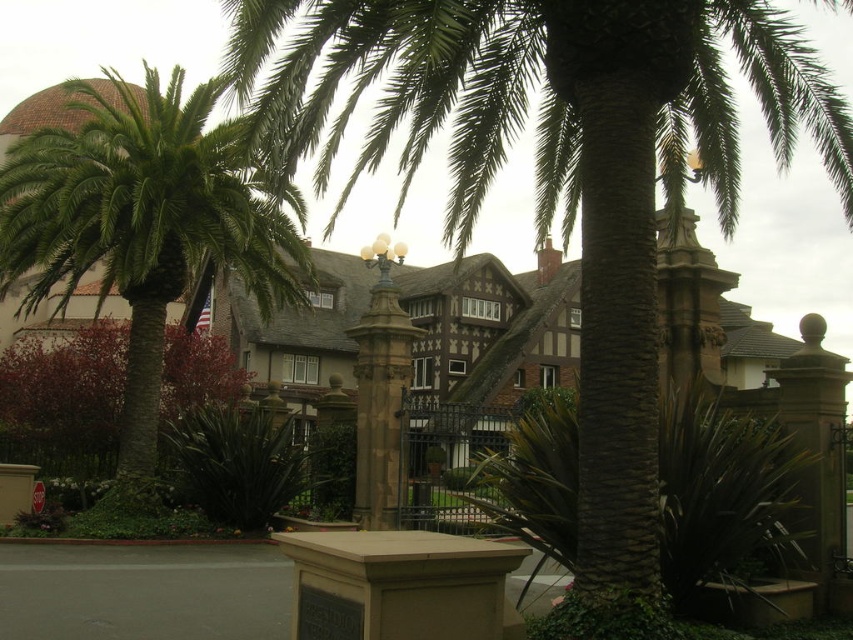
Question: Which object is farther from the camera taking this photo?

Choices:
 (A) green leafy palm tree at center
 (B) green leafy palm at left

Answer: (B)

Question: Which point appears farthest from the camera in this image?

Choices:
 (A) (218, 193)
 (B) (604, 257)

Answer: (A)

Question: From the image, what is the correct spatial relationship of green leafy palm tree at center in relation to green leafy palm at left?

Choices:
 (A) right
 (B) left

Answer: (A)

Question: Is green leafy palm tree at center smaller than green leafy palm at left?

Choices:
 (A) no
 (B) yes

Answer: (A)

Question: Does green leafy palm tree at center have a smaller size compared to green leafy palm at left?

Choices:
 (A) yes
 (B) no

Answer: (B)